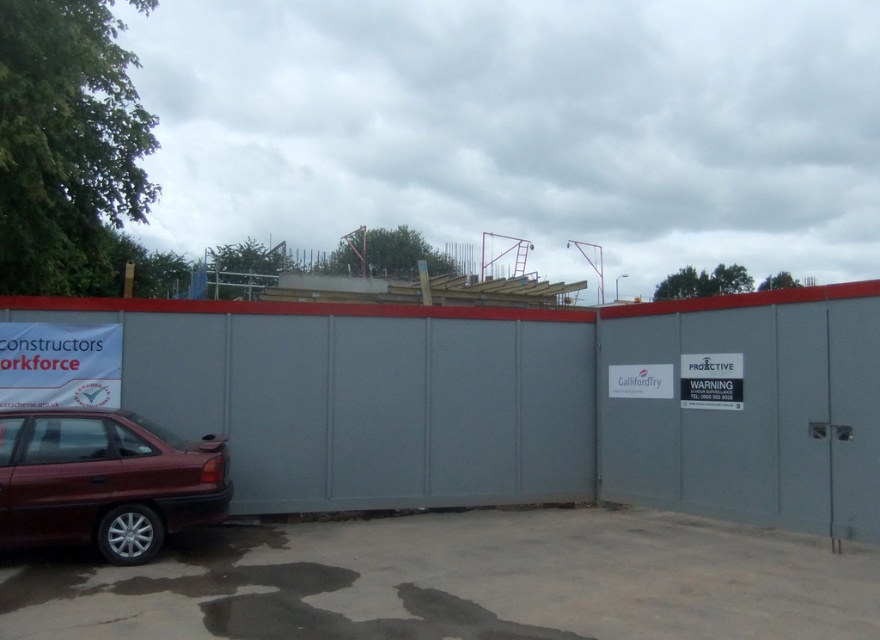
Question: Which of the following is the farthest from the observer?

Choices:
 (A) maroon metallic car at lower left
 (B) white paper sign at left

Answer: (B)

Question: Can you confirm if gray matte fence at center is positioned below white paper sign at left?

Choices:
 (A) no
 (B) yes

Answer: (A)

Question: Which point is closer to the camera?

Choices:
 (A) (132, 556)
 (B) (88, 346)
 (C) (783, 339)

Answer: (A)

Question: Which point appears farthest from the camera in this image?

Choices:
 (A) (572, 428)
 (B) (103, 372)
 (C) (45, 522)

Answer: (A)

Question: Does gray matte fence at center appear over white paper sign at left?

Choices:
 (A) yes
 (B) no

Answer: (A)

Question: Can you confirm if gray matte fence at center is thinner than white paper sign at left?

Choices:
 (A) yes
 (B) no

Answer: (B)